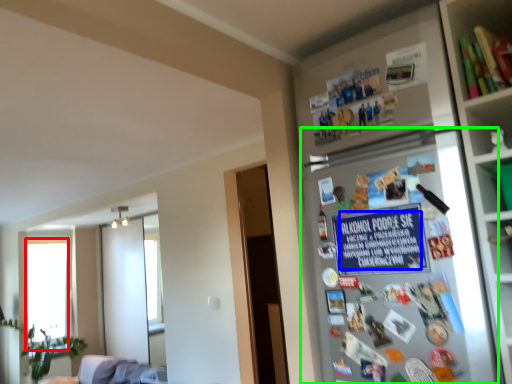
Question: Considering the real-world distances, which object is closest to window screen (highlighted by a red box)? writing (highlighted by a blue box) or fridge (highlighted by a green box).

Choices:
 (A) writing
 (B) fridge

Answer: (B)